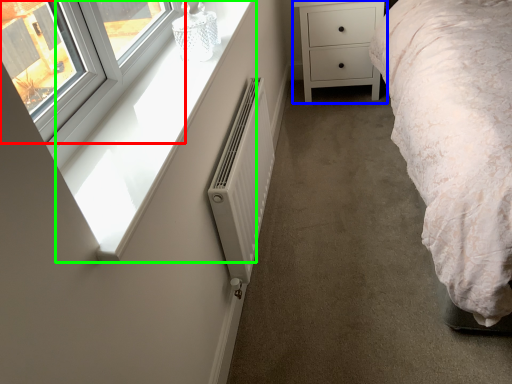
Question: Which object is the farthest from window (highlighted by a red box)? Choose among these: chest of drawers (highlighted by a blue box) or window sill (highlighted by a green box).

Choices:
 (A) chest of drawers
 (B) window sill

Answer: (A)